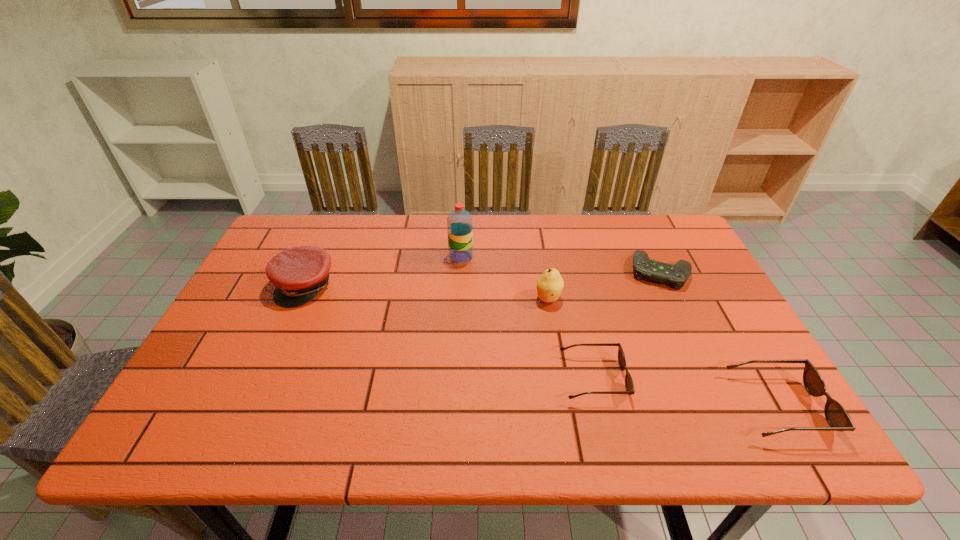
At what (x,y) coordinates should I click in order to perform the action: click on vacant position located 0.370m on the right of the fifth shortest object. Please return your answer as a coordinate pair (x, y). The image size is (960, 540). Looking at the image, I should click on (698, 298).

Find the location of a particular element. free space located on the front of the cap with an emblem is located at coordinates (278, 346).

Identify the location of blank space located on the front label of the water bottle. (490, 256).

You are a GUI agent. You are given a task and a screenshot of the screen. Output one action in this format:
    pyautogui.click(x=<x>, y=<y>)
    Task: Click on the blank space located 0.190m on the back of the control
    The width and height of the screenshot is (960, 540).
    Given the screenshot: What is the action you would take?
    pyautogui.click(x=636, y=220)

Locate an element on the screen. This screenshot has height=540, width=960. water bottle located in the far edge section of the desktop is located at coordinates (459, 222).

Locate an element on the screen. Image resolution: width=960 pixels, height=540 pixels. control that is at the far edge is located at coordinates (676, 275).

Where is `object that is at the left edge`? The width and height of the screenshot is (960, 540). object that is at the left edge is located at coordinates (299, 273).

Locate an element on the screen. The height and width of the screenshot is (540, 960). sunglasses that is at the right edge is located at coordinates (837, 417).

Where is `control positioned at the right edge`? The image size is (960, 540). control positioned at the right edge is located at coordinates (676, 275).

Find the location of a particular element. The width and height of the screenshot is (960, 540). object positioned at the far right corner is located at coordinates (676, 275).